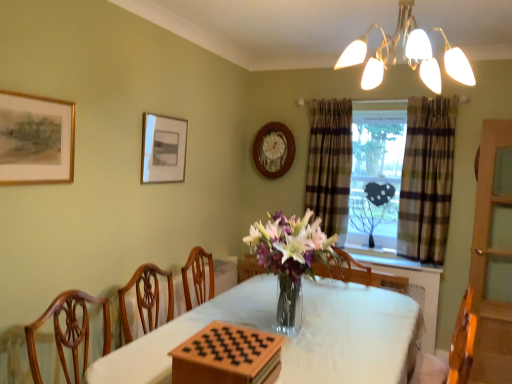
Question: Is plaid fabric curtain at window, arranged as the 2th curtain when viewed from the left, at the back of translucent glass vase at center?

Choices:
 (A) yes
 (B) no

Answer: (B)

Question: Does translucent glass vase at center have a greater height compared to plaid fabric curtain at window, arranged as the 2th curtain when viewed from the left?

Choices:
 (A) yes
 (B) no

Answer: (B)

Question: Is translucent glass vase at center completely or partially outside of plaid fabric curtain at window, arranged as the 2th curtain when viewed from the left?

Choices:
 (A) no
 (B) yes

Answer: (B)

Question: Considering the relative positions of translucent glass vase at center and plaid fabric curtain at window, arranged as the 2th curtain when viewed from the left, in the image provided, is translucent glass vase at center to the left of plaid fabric curtain at window, arranged as the 2th curtain when viewed from the left, from the viewer's perspective?

Choices:
 (A) yes
 (B) no

Answer: (A)

Question: Considering the relative sizes of translucent glass vase at center and plaid fabric curtain at window, arranged as the 2th curtain when viewed from the left, in the image provided, is translucent glass vase at center smaller than plaid fabric curtain at window, arranged as the 2th curtain when viewed from the left,?

Choices:
 (A) no
 (B) yes

Answer: (B)

Question: Is translucent glass vase at center at the right side of plaid fabric curtain at window, positioned as the first curtain in right-to-left order?

Choices:
 (A) yes
 (B) no

Answer: (B)

Question: Is the position of plaid fabric curtain at window, positioned as the first curtain in right-to-left order, less distant than that of translucent glass vase at center?

Choices:
 (A) yes
 (B) no

Answer: (B)

Question: From the image's perspective, is plaid fabric curtain at window, arranged as the 2th curtain when viewed from the left, beneath translucent glass vase at center?

Choices:
 (A) yes
 (B) no

Answer: (B)

Question: Is plaid fabric curtain at window, arranged as the 2th curtain when viewed from the left, located outside translucent glass vase at center?

Choices:
 (A) yes
 (B) no

Answer: (A)

Question: Does plaid fabric curtain at window, arranged as the 2th curtain when viewed from the left, have a greater width compared to translucent glass vase at center?

Choices:
 (A) no
 (B) yes

Answer: (A)

Question: Is plaid fabric curtain at window, positioned as the first curtain in right-to-left order, at the right side of translucent glass vase at center?

Choices:
 (A) yes
 (B) no

Answer: (A)

Question: From a real-world perspective, is plaid fabric curtain at window, positioned as the first curtain in right-to-left order, beneath translucent glass vase at center?

Choices:
 (A) no
 (B) yes

Answer: (A)

Question: Is plaid fabric window at center facing away from translucent glass vase at center?

Choices:
 (A) yes
 (B) no

Answer: (B)